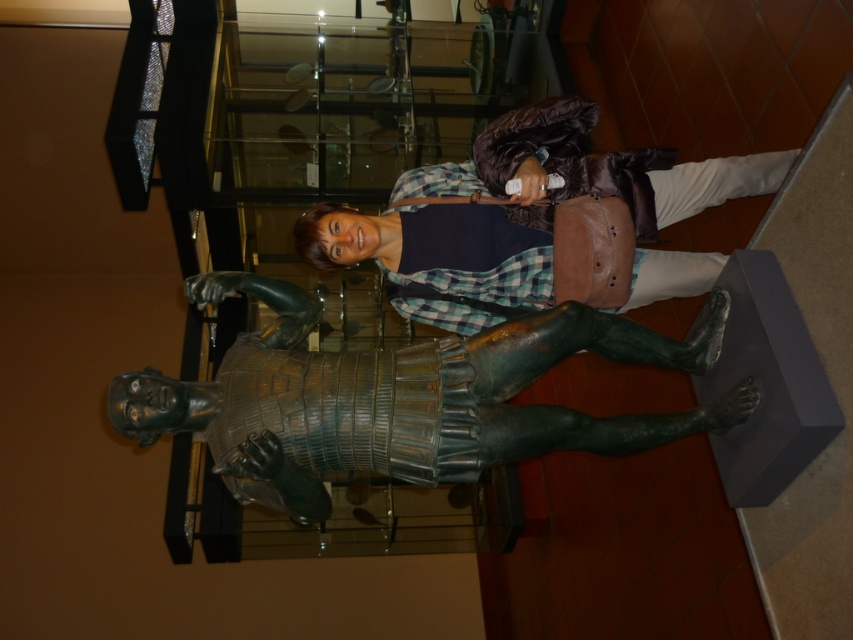
Question: Which point is farther from the camera taking this photo?

Choices:
 (A) (422, 241)
 (B) (268, 492)

Answer: (A)

Question: Does green patinated bronze statue at center appear under matte brown leather bag at center?

Choices:
 (A) yes
 (B) no

Answer: (A)

Question: From the image, what is the correct spatial relationship of green patinated bronze statue at center in relation to matte brown leather bag at center?

Choices:
 (A) below
 (B) above

Answer: (A)

Question: Does green patinated bronze statue at center appear on the left side of matte brown leather bag at center?

Choices:
 (A) no
 (B) yes

Answer: (B)